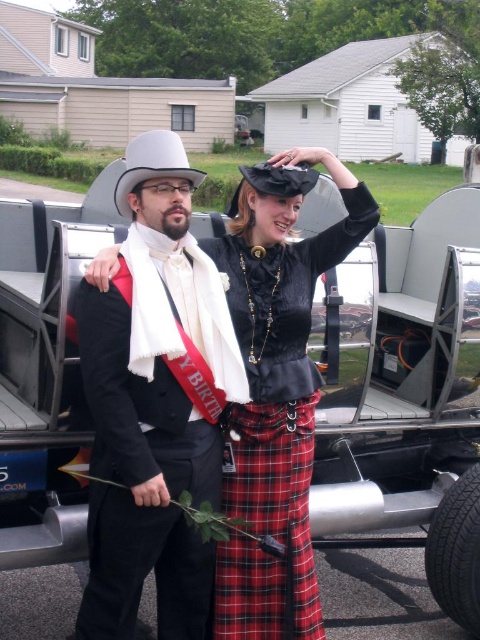
You are a photographer trying to capture a closeup of both the matte black suit at center and the velvet black blouse at center in the image. Given that your camera lens has a maximum focus range of 12 inches, will you be able to focus on both objects simultaneously?

The matte black suit at center and velvet black blouse at center are 12.08 inches apart. Since the distance between them exceeds the camera lens maximum focus range of 12 inches, you cannot focus on both objects simultaneously.

You are a fashion designer observing two outfits in the image. The first is the matte black suit at center, and the second is the velvet black blouse at center. Which outfit is taller?

The matte black suit at center is taller than the velvet black blouse at center.

You are a photographer taking a picture of the two people in the scene. Which clothing item, the matte black suit at center or the velvet black blouse at center, should you focus on first if you want to capture the one that is higher in the frame?

The matte black suit at center is above the velvet black blouse at center, so you should focus on the matte black suit at center first to capture the higher one in the frame.